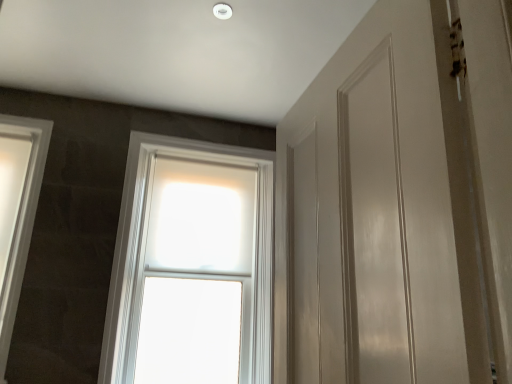
The image size is (512, 384). Find the location of `white glossy window at left, which is the 1th window from left to right`. white glossy window at left, which is the 1th window from left to right is located at coordinates pos(17,211).

The width and height of the screenshot is (512, 384). Describe the element at coordinates (17, 211) in the screenshot. I see `white glossy window at left, which is counted as the second window, starting from the right` at that location.

Measure the distance between point (271, 193) and camera.

Point (271, 193) and camera are 9.65 feet apart from each other.

This screenshot has width=512, height=384. In order to click on white frosted glass window at center, the first window from the right in this screenshot , I will do `click(144, 251)`.

What is the approximate width of white frosted glass window at center, which is the second window from left to right?

10.26 inches.

Describe the element at coordinates (144, 251) in the screenshot. I see `white frosted glass window at center, the first window from the right` at that location.

Locate an element on the screen. white glossy window at left, which is counted as the second window, starting from the right is located at coordinates (17, 211).

Would you say white glossy window at left, which is counted as the second window, starting from the right, is to the left or to the right of white frosted glass window at center, which is the second window from left to right, in the picture?

Based on their positions, white glossy window at left, which is counted as the second window, starting from the right, is located to the left of white frosted glass window at center, which is the second window from left to right.

Which is behind, white glossy window at left, which is counted as the second window, starting from the right, or white frosted glass window at center, which is the second window from left to right?

white frosted glass window at center, which is the second window from left to right, is further from the camera.

Is point (11, 219) positioned before point (143, 257)?

Yes.

From the image's perspective, is white glossy window at left, which is the 1th window from left to right, positioned above or below white frosted glass window at center, the first window from the right?

Clearly, from the image's perspective, white glossy window at left, which is the 1th window from left to right, is above white frosted glass window at center, the first window from the right.

From a real-world perspective, is white glossy window at left, which is the 1th window from left to right, under white frosted glass window at center, the first window from the right?

No, from a real-world perspective, white glossy window at left, which is the 1th window from left to right, is not below white frosted glass window at center, the first window from the right.

Which of these two, white glossy window at left, which is the 1th window from left to right, or white frosted glass window at center, which is the second window from left to right, is wider?

white frosted glass window at center, which is the second window from left to right.

Who is taller, white glossy window at left, which is counted as the second window, starting from the right, or white frosted glass window at center, which is the second window from left to right?

With more height is white frosted glass window at center, which is the second window from left to right.

Based on their sizes in the image, would you say white glossy window at left, which is counted as the second window, starting from the right, is bigger or smaller than white frosted glass window at center, which is the second window from left to right?

In the image, white glossy window at left, which is counted as the second window, starting from the right, appears to be smaller than white frosted glass window at center, which is the second window from left to right.

Would you say white glossy window at left, which is the 1th window from left to right, is inside or outside white frosted glass window at center, the first window from the right?

white glossy window at left, which is the 1th window from left to right, is not enclosed by white frosted glass window at center, the first window from the right.

Is white glossy window at left, which is counted as the second window, starting from the right, next to white frosted glass window at center, the first window from the right?

No, white glossy window at left, which is counted as the second window, starting from the right, is not making contact with white frosted glass window at center, the first window from the right.

Is white glossy window at left, which is counted as the second window, starting from the right, oriented towards white frosted glass window at center, the first window from the right?

No, white glossy window at left, which is counted as the second window, starting from the right, is not aimed at white frosted glass window at center, the first window from the right.

How many degrees apart are the facing directions of white glossy window at left, which is the 1th window from left to right, and white frosted glass window at center, which is the second window from left to right?

0.904 degrees.

How far apart are white glossy window at left, which is the 1th window from left to right, and white frosted glass window at center, the first window from the right?

white glossy window at left, which is the 1th window from left to right, is 76.28 centimeters away from white frosted glass window at center, the first window from the right.

This screenshot has height=384, width=512. In order to click on window on the right of white glossy window at left, which is the 1th window from left to right in this screenshot , I will do `click(144, 251)`.

Between white frosted glass window at center, which is the second window from left to right, and white glossy window at left, which is the 1th window from left to right, which one appears on the right side from the viewer's perspective?

From the viewer's perspective, white frosted glass window at center, which is the second window from left to right, appears more on the right side.

Is the depth of white frosted glass window at center, which is the second window from left to right, less than that of white glossy window at left, which is the 1th window from left to right?

No, white frosted glass window at center, which is the second window from left to right, is behind white glossy window at left, which is the 1th window from left to right.

Which is closer to the camera, (249, 153) or (34, 202)?

The point (34, 202) is closer.

From the image's perspective, does white frosted glass window at center, which is the second window from left to right, appear higher than white glossy window at left, which is counted as the second window, starting from the right?

Incorrect, from the image's perspective, white frosted glass window at center, which is the second window from left to right, is lower than white glossy window at left, which is counted as the second window, starting from the right.

From a real-world perspective, is white frosted glass window at center, the first window from the right, on white glossy window at left, which is the 1th window from left to right?

No.

Considering the relative sizes of white frosted glass window at center, which is the second window from left to right, and white glossy window at left, which is counted as the second window, starting from the right, in the image provided, is white frosted glass window at center, which is the second window from left to right, wider than white glossy window at left, which is counted as the second window, starting from the right,?

Correct, the width of white frosted glass window at center, which is the second window from left to right, exceeds that of white glossy window at left, which is counted as the second window, starting from the right.

Between white frosted glass window at center, the first window from the right, and white glossy window at left, which is counted as the second window, starting from the right, which one has less height?

Standing shorter between the two is white glossy window at left, which is counted as the second window, starting from the right.

Which of these two, white frosted glass window at center, the first window from the right, or white glossy window at left, which is counted as the second window, starting from the right, is smaller?

Smaller between the two is white glossy window at left, which is counted as the second window, starting from the right.

Is white glossy window at left, which is counted as the second window, starting from the right, surrounded by white frosted glass window at center, the first window from the right?

That's incorrect, white glossy window at left, which is counted as the second window, starting from the right, is not inside white frosted glass window at center, the first window from the right.

Is white frosted glass window at center, which is the second window from left to right, next to white glossy window at left, which is the 1th window from left to right, and touching it?

No, white frosted glass window at center, which is the second window from left to right, is not next to white glossy window at left, which is the 1th window from left to right.

Is white frosted glass window at center, which is the second window from left to right, oriented towards white glossy window at left, which is counted as the second window, starting from the right?

No, white frosted glass window at center, which is the second window from left to right, does not turn towards white glossy window at left, which is counted as the second window, starting from the right.

How many degrees apart are the facing directions of white frosted glass window at center, the first window from the right, and white glossy window at left, which is counted as the second window, starting from the right?

They differ by 0.904 degrees in their facing directions.

How far apart are white frosted glass window at center, which is the second window from left to right, and white glossy window at left, which is the 1th window from left to right?

white frosted glass window at center, which is the second window from left to right, is 30.03 inches away from white glossy window at left, which is the 1th window from left to right.

In order to click on window on the right of the white glossy window at left, which is the 1th window from left to right in this screenshot , I will do [x=144, y=251].

Identify the location of window lying behind the white glossy window at left, which is the 1th window from left to right. (144, 251).

The width and height of the screenshot is (512, 384). In order to click on window that appears on the left of white frosted glass window at center, the first window from the right in this screenshot , I will do `click(17, 211)`.